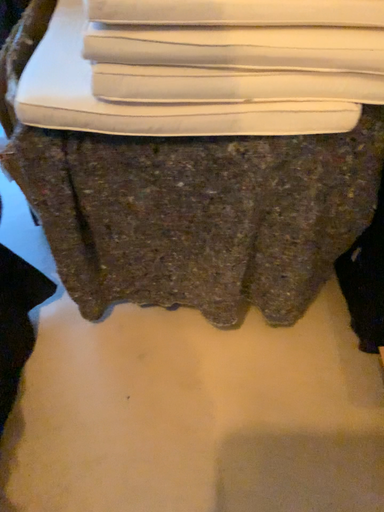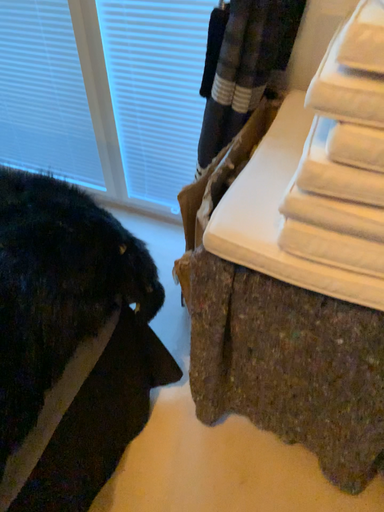
Question: How did the camera likely rotate when shooting the video?

Choices:
 (A) rotated left
 (B) rotated right

Answer: (A)